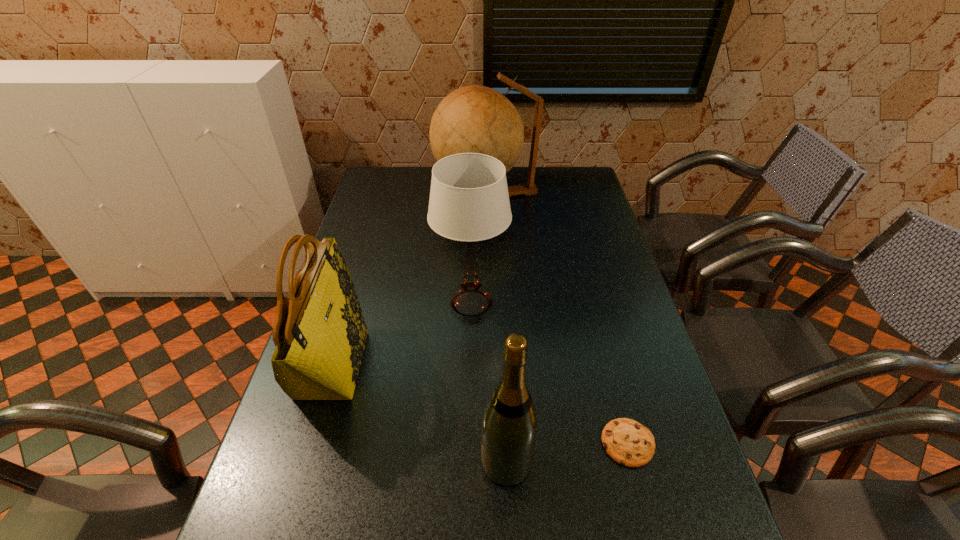
Locate an element on the screen. The height and width of the screenshot is (540, 960). vacant space at the right edge is located at coordinates (612, 236).

In the image, there is a desktop. At what (x,y) coordinates should I click in order to perform the action: click on free space at the far left corner. Please return your answer as a coordinate pair (x, y). Looking at the image, I should click on (387, 188).

You are a GUI agent. You are given a task and a screenshot of the screen. Output one action in this format:
    pyautogui.click(x=<x>, y=<y>)
    Task: Click on the unoccupied position between the globe and the leftmost object
    The width and height of the screenshot is (960, 540).
    Given the screenshot: What is the action you would take?
    [x=409, y=281]

What are the coordinates of `free space between the cookie and the leftmost object` in the screenshot? It's located at (481, 404).

Where is `vacant space that is in between the wine bottle and the globe`? This screenshot has width=960, height=540. vacant space that is in between the wine bottle and the globe is located at coordinates (496, 330).

Identify the location of free space between the tote bag and the wine bottle. The image size is (960, 540). (420, 413).

The image size is (960, 540). Find the location of `vacant space in between the leftmost object and the shortest object`. vacant space in between the leftmost object and the shortest object is located at coordinates (481, 404).

This screenshot has height=540, width=960. In order to click on vacant area that lies between the wine bottle and the cookie in this screenshot , I will do `click(567, 453)`.

This screenshot has height=540, width=960. I want to click on blank region between the cookie and the farthest object, so click(x=557, y=321).

Find the location of a particular element. This screenshot has height=540, width=960. vacant area that lies between the table lamp and the leftmost object is located at coordinates (402, 334).